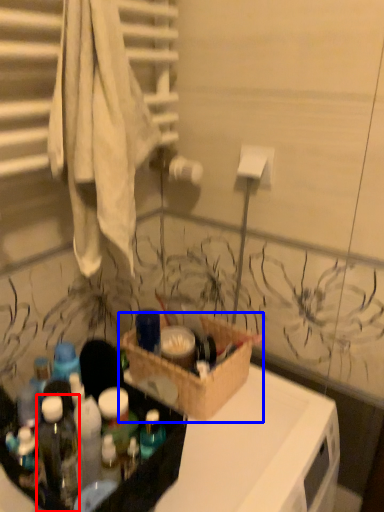
Question: Which of the following is the closest to the observer, bottle (highlighted by a red box) or box (highlighted by a blue box)?

Choices:
 (A) bottle
 (B) box

Answer: (A)